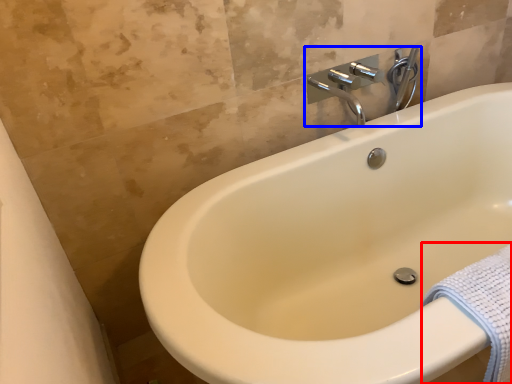
Question: Among these objects, which one is farthest to the camera, bath towel (highlighted by a red box) or tap (highlighted by a blue box)?

Choices:
 (A) bath towel
 (B) tap

Answer: (B)